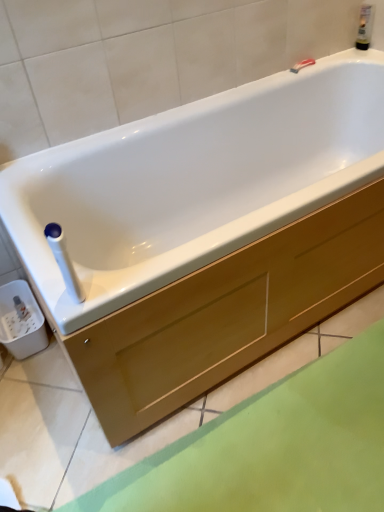
Question: Is white plastic towel bar at upper left at the right side of matte wood drawer at center?

Choices:
 (A) yes
 (B) no

Answer: (B)

Question: From a real-world perspective, is white plastic towel bar at upper left located beneath matte wood drawer at center?

Choices:
 (A) no
 (B) yes

Answer: (A)

Question: Does white plastic towel bar at upper left have a greater width compared to matte wood drawer at center?

Choices:
 (A) no
 (B) yes

Answer: (A)

Question: Is white plastic towel bar at upper left not near matte wood drawer at center?

Choices:
 (A) yes
 (B) no

Answer: (B)

Question: From the image's perspective, is white plastic towel bar at upper left on matte wood drawer at center?

Choices:
 (A) no
 (B) yes

Answer: (B)

Question: Considering the relative positions of white plastic towel bar at upper left and matte wood drawer at center in the image provided, is white plastic towel bar at upper left to the left or to the right of matte wood drawer at center?

Choices:
 (A) right
 (B) left

Answer: (B)

Question: In terms of height, does white plastic towel bar at upper left look taller or shorter compared to matte wood drawer at center?

Choices:
 (A) short
 (B) tall

Answer: (B)

Question: Is white plastic towel bar at upper left spatially inside matte wood drawer at center, or outside of it?

Choices:
 (A) inside
 (B) outside

Answer: (B)

Question: From a real-world perspective, is white plastic towel bar at upper left physically located above or below matte wood drawer at center?

Choices:
 (A) below
 (B) above

Answer: (B)

Question: Is translucent plastic bottle at upper right taller or shorter than white plastic towel bar at upper left?

Choices:
 (A) tall
 (B) short

Answer: (B)

Question: In terms of width, does translucent plastic bottle at upper right look wider or thinner when compared to white plastic towel bar at upper left?

Choices:
 (A) wide
 (B) thin

Answer: (B)

Question: Is translucent plastic bottle at upper right in front of or behind white plastic towel bar at upper left in the image?

Choices:
 (A) front
 (B) behind

Answer: (B)

Question: Is translucent plastic bottle at upper right to the left or to the right of white plastic towel bar at upper left in the image?

Choices:
 (A) left
 (B) right

Answer: (B)

Question: From a real-world perspective, relative to translucent plastic bottle at upper right, is white plastic towel bar at upper left vertically above or below?

Choices:
 (A) above
 (B) below

Answer: (B)

Question: In terms of width, does white plastic towel bar at upper left look wider or thinner when compared to translucent plastic bottle at upper right?

Choices:
 (A) wide
 (B) thin

Answer: (A)